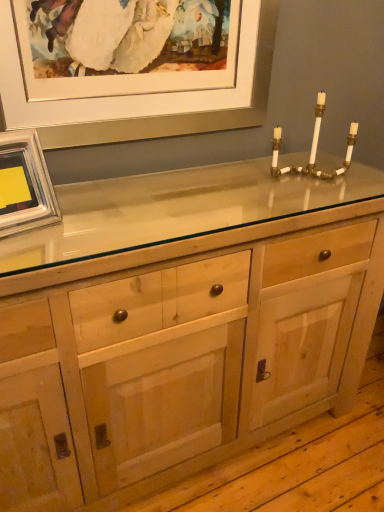
Where is `vacant space underneath matte white picture frame at upper center, the 1th picture frame positioned from the top (from a real-world perspective)`? The width and height of the screenshot is (384, 512). vacant space underneath matte white picture frame at upper center, the 1th picture frame positioned from the top (from a real-world perspective) is located at coordinates (170, 172).